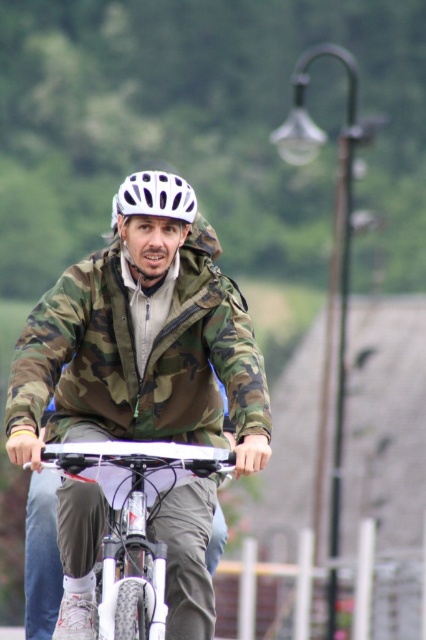
Can you confirm if white matte bicycle at center is thinner than white matte helmet at center?

No.

Between point (36, 518) and point (175, 177), which one is positioned behind?

Positioned behind is point (36, 518).

The image size is (426, 640). In order to click on white matte bicycle at center in this screenshot , I will do `click(42, 556)`.

Locate an element on the screen. This screenshot has width=426, height=640. camo fabric jacket at center is located at coordinates (141, 349).

Is point (120, 368) closer to viewer compared to point (152, 184)?

No, it is behind (152, 184).

Which is in front, point (89, 276) or point (161, 209)?

Point (161, 209) is more forward.

Where is `camo fabric jacket at center`? camo fabric jacket at center is located at coordinates point(141,349).

Is camo fabric jacket at center further to the viewer compared to white matte bicycle at center?

Yes, it is.

Does camo fabric jacket at center have a lesser width compared to white matte bicycle at center?

Indeed, camo fabric jacket at center has a lesser width compared to white matte bicycle at center.

Image resolution: width=426 pixels, height=640 pixels. I want to click on camo fabric jacket at center, so click(141, 349).

At what (x,y) coordinates should I click in order to perform the action: click on camo fabric jacket at center. Please return your answer as a coordinate pair (x, y). This screenshot has width=426, height=640. Looking at the image, I should click on (141, 349).